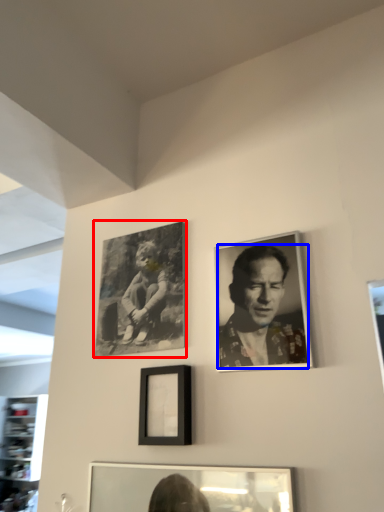
Question: Which object appears closest to the camera in this image, picture frame (highlighted by a red box) or man (highlighted by a blue box)?

Choices:
 (A) picture frame
 (B) man

Answer: (B)